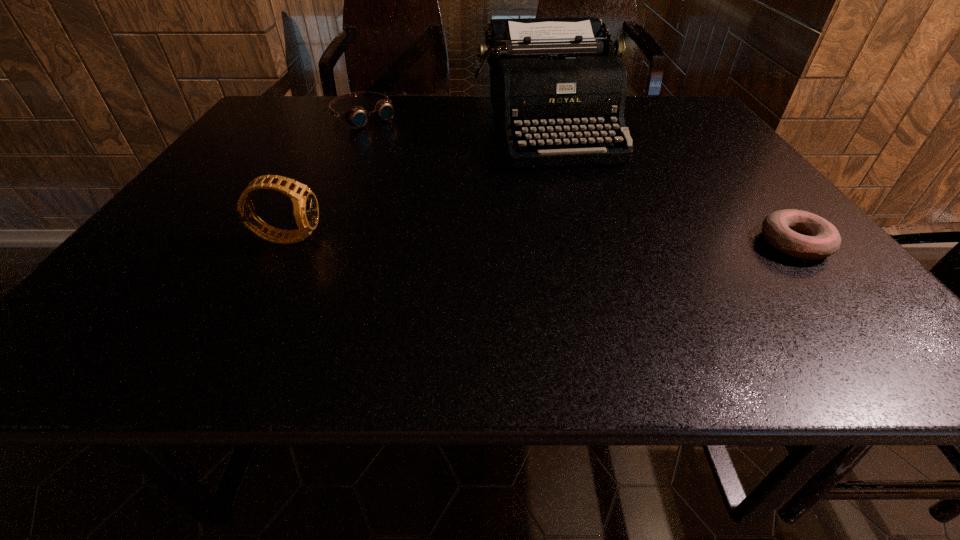
Image resolution: width=960 pixels, height=540 pixels. Identify the location of vacant space located on the typing side of the typewriter. (583, 210).

Locate an element on the screen. The width and height of the screenshot is (960, 540). vacant space located 0.120m through the lenses of the third tallest object is located at coordinates (397, 145).

Find the location of a particular element. The width and height of the screenshot is (960, 540). vacant area located through the lenses of the third tallest object is located at coordinates (389, 138).

At what (x,y) coordinates should I click in order to perform the action: click on vacant space located 0.190m through the lenses of the third tallest object. Please return your answer as a coordinate pair (x, y). The image size is (960, 540). Looking at the image, I should click on (410, 156).

In order to click on typewriter situated at the far edge in this screenshot , I will do `click(558, 81)`.

Locate an element on the screen. goggles present at the far edge is located at coordinates click(356, 116).

You are a GUI agent. You are given a task and a screenshot of the screen. Output one action in this format:
    pyautogui.click(x=<x>, y=<y>)
    Task: Click on the object situated at the right edge
    
    Given the screenshot: What is the action you would take?
    pyautogui.click(x=800, y=234)

This screenshot has width=960, height=540. In order to click on vacant space at the far edge of the desktop in this screenshot , I will do `click(315, 120)`.

In the image, there is a desktop. At what (x,y) coordinates should I click in order to perform the action: click on vacant space at the near edge. Please return your answer as a coordinate pair (x, y). Image resolution: width=960 pixels, height=540 pixels. Looking at the image, I should click on (755, 286).

Where is `blank space at the left edge of the desktop`? This screenshot has height=540, width=960. blank space at the left edge of the desktop is located at coordinates (205, 198).